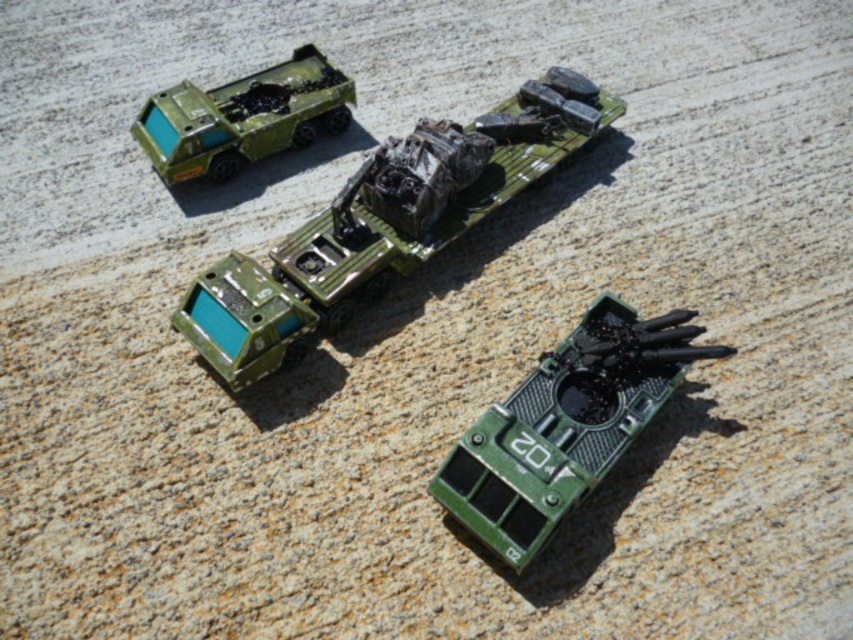
Question: Does matte green truck at center come behind green matte tank at lower right?

Choices:
 (A) no
 (B) yes

Answer: (B)

Question: Is matte green truck at center below matte green plastic truck at upper left?

Choices:
 (A) yes
 (B) no

Answer: (A)

Question: Is matte green truck at center thinner than matte green plastic truck at upper left?

Choices:
 (A) yes
 (B) no

Answer: (B)

Question: Considering the real-world distances, which object is closest to the green matte tank at lower right?

Choices:
 (A) matte green plastic truck at upper left
 (B) matte green truck at center

Answer: (B)

Question: Which point is closer to the camera?

Choices:
 (A) matte green plastic truck at upper left
 (B) green matte tank at lower right

Answer: (B)

Question: Among these objects, which one is farthest from the camera?

Choices:
 (A) matte green plastic truck at upper left
 (B) matte green truck at center

Answer: (A)